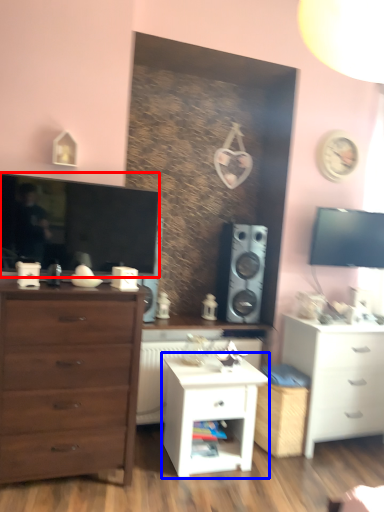
Question: Which object appears closest to the camera in this image, television (highlighted by a red box) or nightstand (highlighted by a blue box)?

Choices:
 (A) television
 (B) nightstand

Answer: (A)